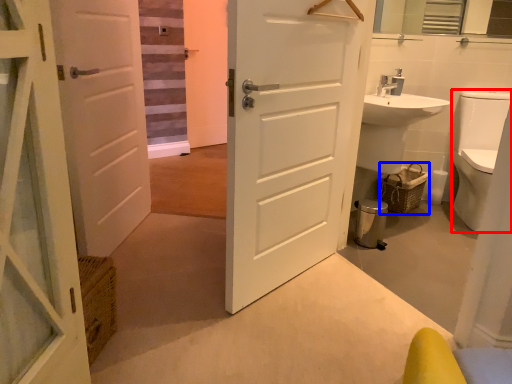
Question: Among these objects, which one is farthest to the camera, toilet bowl (highlighted by a red box) or basket (highlighted by a blue box)?

Choices:
 (A) toilet bowl
 (B) basket

Answer: (B)